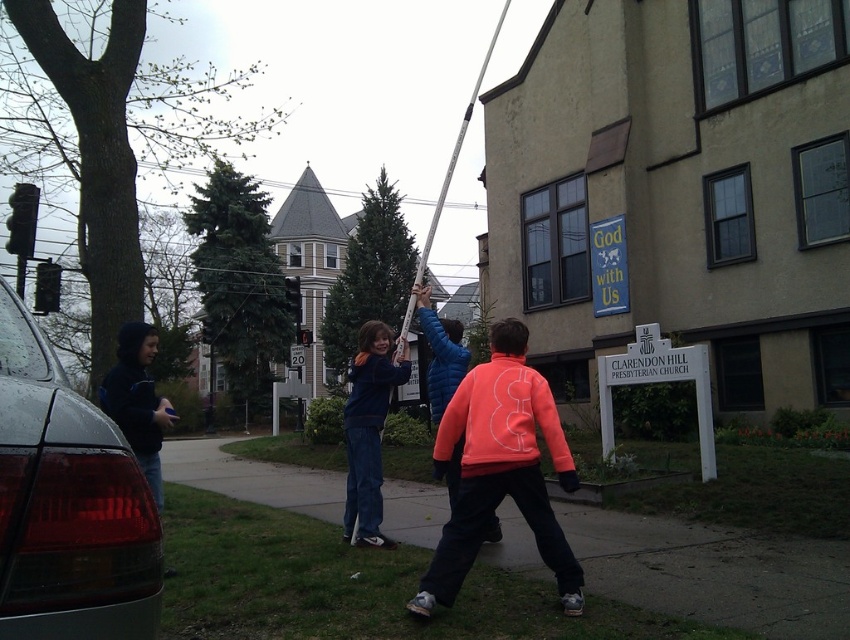
Which is in front, point (154, 550) or point (153, 412)?

Point (154, 550) is more forward.

Can you confirm if shiny black car at left is wider than dark blue hoodie at left?

Indeed, shiny black car at left has a greater width compared to dark blue hoodie at left.

Image resolution: width=850 pixels, height=640 pixels. What do you see at coordinates (68, 502) in the screenshot?
I see `shiny black car at left` at bounding box center [68, 502].

Identify the location of shiny black car at left. (68, 502).

Is smooth concrete sidewalk at center further to camera compared to orange fleece jacket at center?

No, smooth concrete sidewalk at center is closer to the viewer.

Locate an element on the screen. This screenshot has height=640, width=850. smooth concrete sidewalk at center is located at coordinates (714, 572).

Who is more forward, (564,582) or (360,461)?

Point (564,582) is in front.

Between orange fleece jacket at center and blue denim pants at center, which one is positioned lower?

Positioned lower is blue denim pants at center.

At what (x,y) coordinates should I click in order to perform the action: click on orange fleece jacket at center. Please return your answer as a coordinate pair (x, y). The height and width of the screenshot is (640, 850). Looking at the image, I should click on click(500, 468).